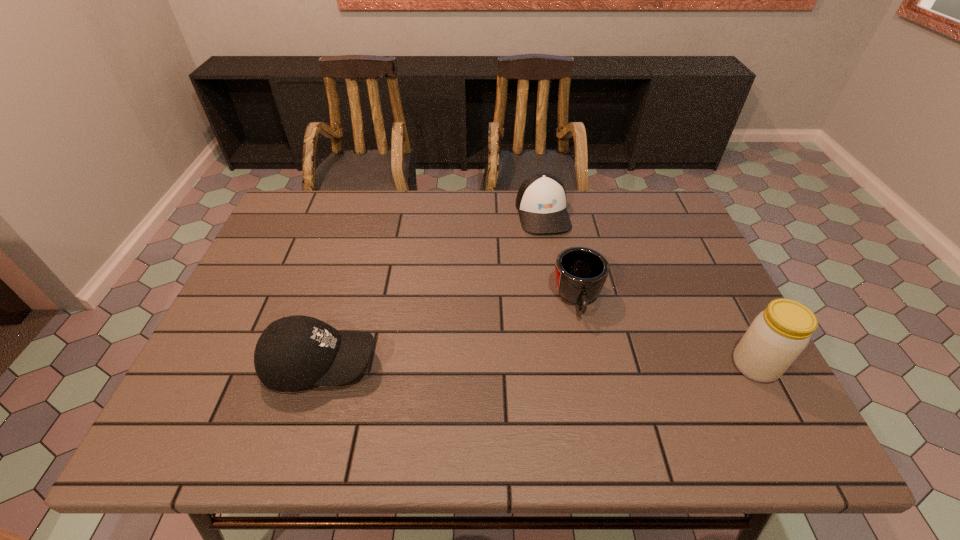
Where is `the leftmost object`? This screenshot has height=540, width=960. the leftmost object is located at coordinates (294, 352).

Identify the location of jar. (777, 336).

The width and height of the screenshot is (960, 540). In order to click on the rightmost object in this screenshot , I will do `click(777, 336)`.

In order to click on the farthest object in this screenshot , I will do `click(541, 200)`.

At what (x,y) coordinates should I click in order to perform the action: click on mug. Please return your answer as a coordinate pair (x, y). The width and height of the screenshot is (960, 540). Looking at the image, I should click on (580, 273).

Identify the location of vacant space situated on the front-facing side of the leftmost object. This screenshot has height=540, width=960. (502, 364).

Locate an element on the screen. The image size is (960, 540). blank space located 0.340m on the back of the rightmost object is located at coordinates (695, 251).

In order to click on free point located 0.260m on the front panel of the cap in this screenshot , I will do `click(568, 302)`.

This screenshot has height=540, width=960. What are the coordinates of `vacant region located on the front panel of the cap` in the screenshot? It's located at pyautogui.click(x=554, y=253).

Find the location of a particular element. vacant point located 0.140m on the front panel of the cap is located at coordinates (559, 269).